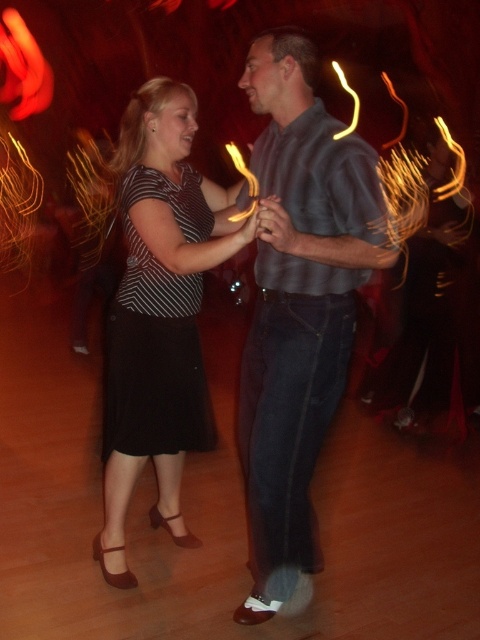
Question: In this image, where is matte black dress at center located relative to black matte dress at center?

Choices:
 (A) left
 (B) right

Answer: (B)

Question: Which object is positioned closest to the dark blue jeans at center?

Choices:
 (A) matte black dress at center
 (B) black matte dress at center

Answer: (A)

Question: Among these points, which one is farthest from the camera?

Choices:
 (A) (143, 177)
 (B) (144, 378)
 (C) (261, 476)

Answer: (B)

Question: Observing the image, what is the correct spatial positioning of dark blue jeans at center in reference to black matte dress at center?

Choices:
 (A) below
 (B) above

Answer: (A)

Question: Is dark blue jeans at center above matte black dress at center?

Choices:
 (A) no
 (B) yes

Answer: (A)

Question: Which is nearer to the black matte dress at center?

Choices:
 (A) matte black dress at center
 (B) dark blue jeans at center

Answer: (A)